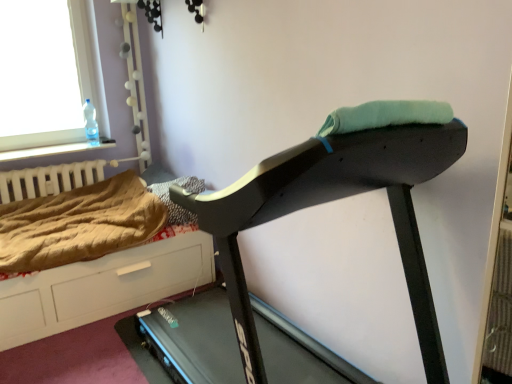
Question: Is brown textured blanket at center, which appears as the first blanket when viewed from the right, situated inside black plastic treadmill at center or outside?

Choices:
 (A) outside
 (B) inside

Answer: (A)

Question: Looking at their shapes, would you say brown textured blanket at center, which is the second blanket from left to right, is wider or thinner than black plastic treadmill at center?

Choices:
 (A) wide
 (B) thin

Answer: (B)

Question: Considering the real-world distances, which object is closest to the brown textured blanket at left, placed as the second blanket when sorted from right to left?

Choices:
 (A) black plastic treadmill at center
 (B) transparent glass window at upper left
 (C) brown wood dresser at lower left
 (D) brown textured blanket at center, which is the second blanket from left to right
 (E) white matte radiator at left

Answer: (C)

Question: Based on their relative distances, which object is farther from the transparent glass window at upper left?

Choices:
 (A) white matte radiator at left
 (B) brown textured blanket at center, which appears as the first blanket when viewed from the right
 (C) black plastic treadmill at center
 (D) brown textured blanket at left, placed as the second blanket when sorted from right to left
 (E) brown wood dresser at lower left

Answer: (C)